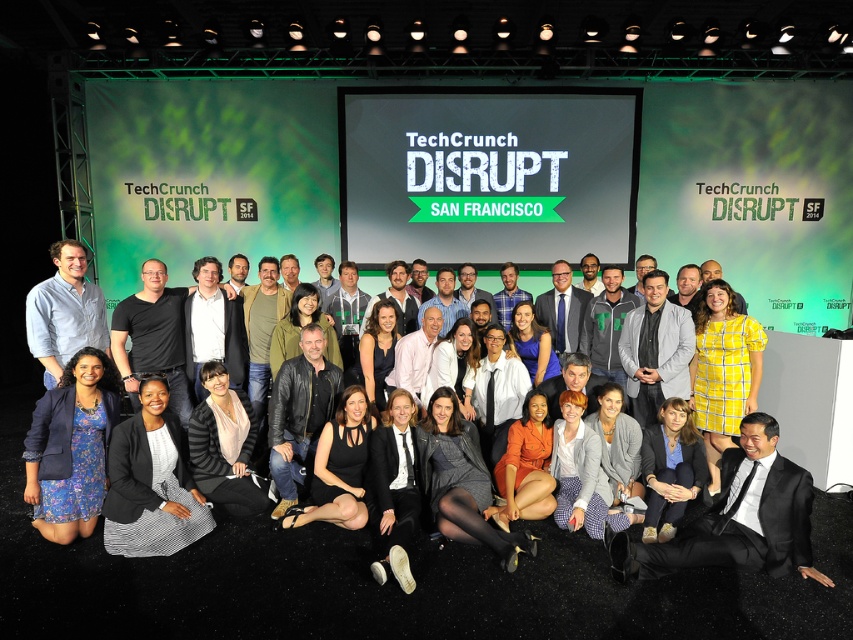
Question: Which point is closer to the camera taking this photo?

Choices:
 (A) (730, 474)
 (B) (642, 326)
 (C) (86, 499)
 (D) (570, 337)

Answer: (A)

Question: Is matte blue shirt at left bigger than matte black suit at center?

Choices:
 (A) no
 (B) yes

Answer: (B)

Question: Which object appears closest to the camera in this image?

Choices:
 (A) gray fabric jacket at center
 (B) blue floral dress at lower left
 (C) matte blue shirt at left

Answer: (B)

Question: Is blue floral dress at lower left positioned behind matte blue shirt at left?

Choices:
 (A) no
 (B) yes

Answer: (A)

Question: Can you confirm if blue floral dress at lower left is wider than matte blue shirt at left?

Choices:
 (A) no
 (B) yes

Answer: (A)

Question: Among these points, which one is nearest to the camera?

Choices:
 (A) (74, 348)
 (B) (577, 340)

Answer: (A)